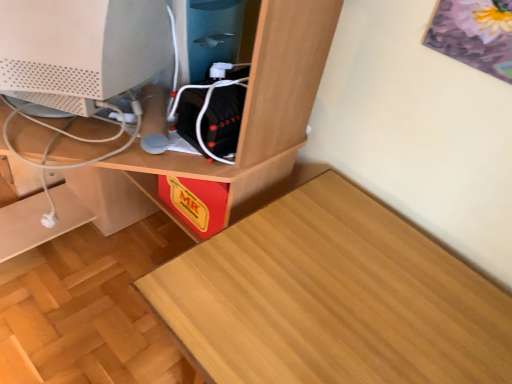
The height and width of the screenshot is (384, 512). I want to click on white matte computer monitor at center, so click(81, 49).

Where is `wooden table at lower left`? wooden table at lower left is located at coordinates (331, 298).

I want to click on white matte computer monitor at center, so click(81, 49).

Would you consider wooden desk at center to be distant from wooden table at lower left?

wooden desk at center is near wooden table at lower left, not far away.

Is wooden desk at center bigger or smaller than wooden table at lower left?

Answer: Considering their sizes, wooden desk at center takes up more space than wooden table at lower left.

What's the angular difference between wooden desk at center and wooden table at lower left's facing directions?

The angle between the facing direction of wooden desk at center and the facing direction of wooden table at lower left is 0.00948 degrees.

Which is more to the right, wooden desk at center or wooden table at lower left?

wooden table at lower left is more to the right.

Is white matte computer monitor at center completely or partially inside wooden desk at center?

Absolutely, white matte computer monitor at center is inside wooden desk at center.

The image size is (512, 384). Find the location of `computer monitor above the wooden desk at center (from the image's perspective)`. computer monitor above the wooden desk at center (from the image's perspective) is located at coordinates (81, 49).

Is wooden desk at center taller than white matte computer monitor at center?

Yes, wooden desk at center is taller than white matte computer monitor at center.

Based on their sizes in the image, would you say white matte computer monitor at center is bigger or smaller than wooden desk at center?

In the image, white matte computer monitor at center appears to be smaller than wooden desk at center.

Who is more distant, white matte computer monitor at center or wooden desk at center?

white matte computer monitor at center.

Is white matte computer monitor at center shorter than wooden desk at center?

Yes, white matte computer monitor at center is shorter than wooden desk at center.

Could wooden desk at center be considered to be inside white matte computer monitor at center?

Definitely not — wooden desk at center is not inside white matte computer monitor at center.

How much distance is there between wooden table at lower left and white matte computer monitor at center?

wooden table at lower left and white matte computer monitor at center are 55.78 centimeters apart.

Is wooden table at lower left far from white matte computer monitor at center?

wooden table at lower left is near white matte computer monitor at center, not far away.

Would you say wooden table at lower left is to the left or to the right of white matte computer monitor at center in the picture?

Based on their positions, wooden table at lower left is located to the right of white matte computer monitor at center.

This screenshot has height=384, width=512. Find the location of `table that is below the white matte computer monitor at center (from the image's perspective)`. table that is below the white matte computer monitor at center (from the image's perspective) is located at coordinates (331, 298).

Would you say white matte computer monitor at center is a long distance from wooden table at lower left?

No, there isn't a large distance between white matte computer monitor at center and wooden table at lower left.

From the image's perspective, is white matte computer monitor at center over wooden table at lower left?

Correct, white matte computer monitor at center appears higher than wooden table at lower left in the image.

Identify the location of desk positioned vertically above the wooden table at lower left (from a real-world perspective). (197, 157).

Which is more to the left, wooden table at lower left or wooden desk at center?

wooden desk at center is more to the left.

What's the angular difference between wooden table at lower left and wooden desk at center's facing directions?

0.00948 degrees.

Find the location of a particular element. The width and height of the screenshot is (512, 384). desk that is on the left side of wooden table at lower left is located at coordinates (197, 157).

Locate an element on the screen. computer monitor positioned vertically above the wooden desk at center (from a real-world perspective) is located at coordinates (81, 49).

When comparing their distances from wooden desk at center, does white matte computer monitor at center or wooden table at lower left seem further?

Answer: wooden table at lower left.

Estimate the real-world distances between objects in this image. Which object is further from wooden table at lower left, white matte computer monitor at center or wooden desk at center?

Based on the image, white matte computer monitor at center appears to be further to wooden table at lower left.

Looking at the image, which one is located further to white matte computer monitor at center, wooden desk at center or wooden table at lower left?

wooden table at lower left lies further to white matte computer monitor at center than the other object.

Considering their positions, is wooden desk at center positioned closer to wooden table at lower left than white matte computer monitor at center?

Among the two, wooden desk at center is located nearer to wooden table at lower left.

Consider the image. Which object lies nearer to the anchor point white matte computer monitor at center, wooden table at lower left or wooden desk at center?

wooden desk at center.

Which object lies nearer to the anchor point wooden desk at center, wooden table at lower left or white matte computer monitor at center?

Among the two, white matte computer monitor at center is located nearer to wooden desk at center.

Where is `desk between white matte computer monitor at center and wooden table at lower left in the up-down direction`? Image resolution: width=512 pixels, height=384 pixels. desk between white matte computer monitor at center and wooden table at lower left in the up-down direction is located at coordinates (197, 157).